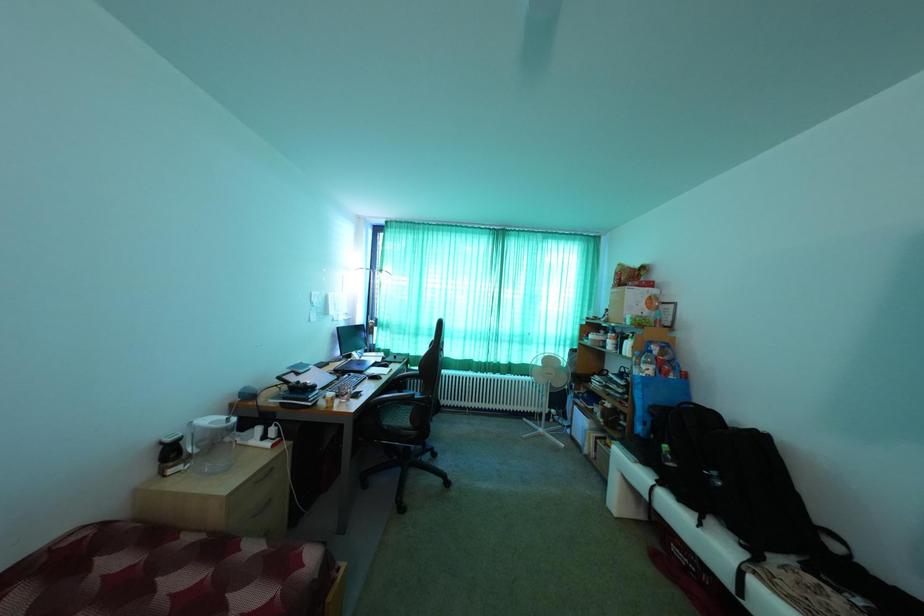
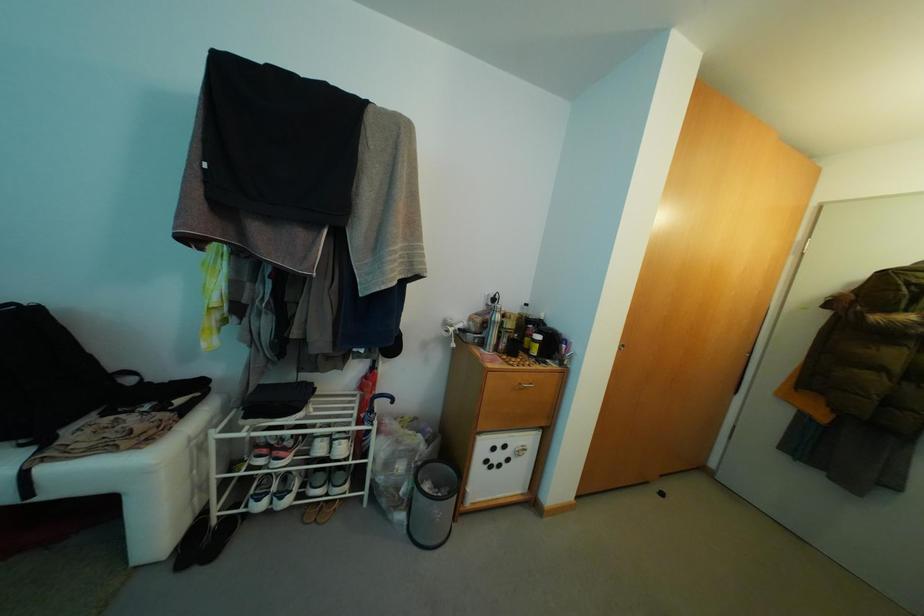
Question: Based on the continuous images, in which direction is the camera rotating? Reply with the corresponding letter.

Choices:
 (A) Left
 (B) Right
 (C) Up
 (D) Down

Answer: (B)